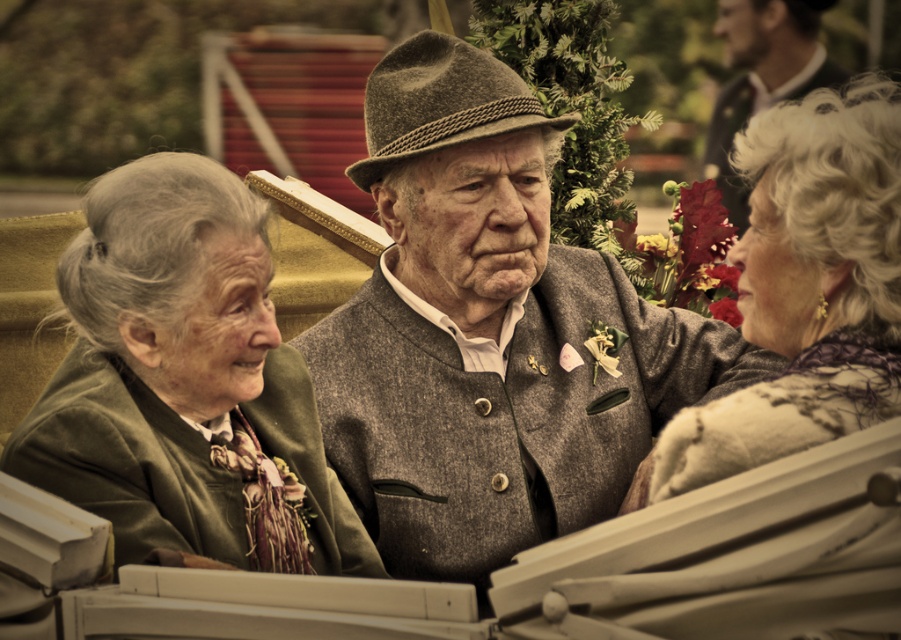
Question: Which object is the farthest from the matte gray scarf at right?

Choices:
 (A) green woolen coat at left
 (B) textured woolen jacket at center
 (C) dark gray wool jacket at upper right

Answer: (C)

Question: Which object is closer to the camera taking this photo?

Choices:
 (A) textured woolen jacket at center
 (B) dark gray wool jacket at upper right
 (C) green woolen coat at left

Answer: (C)

Question: Can you confirm if matte gray scarf at right is positioned to the left of dark gray wool jacket at upper right?

Choices:
 (A) no
 (B) yes

Answer: (B)

Question: Which point is closer to the camera taking this photo?

Choices:
 (A) [x=423, y=177]
 (B) [x=716, y=112]
 (C) [x=810, y=284]

Answer: (C)

Question: Is textured woolen jacket at center thinner than matte gray scarf at right?

Choices:
 (A) no
 (B) yes

Answer: (A)

Question: Can you confirm if green woolen coat at left is positioned to the left of matte gray scarf at right?

Choices:
 (A) no
 (B) yes

Answer: (B)